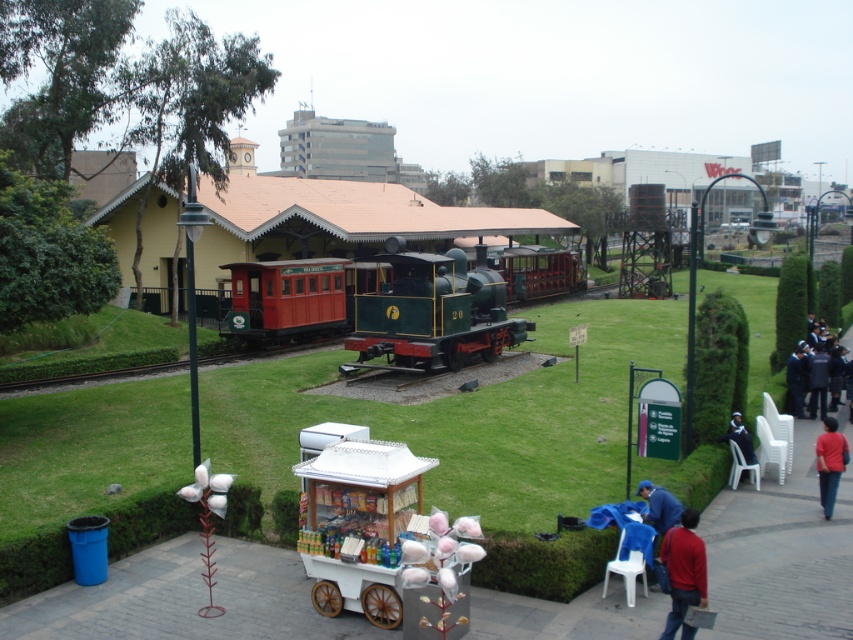
Question: Observing the image, what is the correct spatial positioning of dark blue uniform at right in reference to green metal train track at center?

Choices:
 (A) right
 (B) left

Answer: (A)

Question: Is green metal train track at center wider than black fabric jacket at lower right?

Choices:
 (A) no
 (B) yes

Answer: (B)

Question: Which of the following is the closest to the observer?

Choices:
 (A) red wooden train car at center
 (B) green polished wood train at center

Answer: (B)

Question: Which point appears closest to the camera in this image?

Choices:
 (A) (413, 541)
 (B) (669, 500)
 (C) (328, 332)

Answer: (A)

Question: Is metallic cart at center bigger than red matte jacket at lower right?

Choices:
 (A) yes
 (B) no

Answer: (A)

Question: Which is farther from the red cotton candy at lower right?

Choices:
 (A) red matte jacket at lower right
 (B) white wood cotton candy cart at center
 (C) green metal train track at center
 (D) black fabric jacket at lower right

Answer: (C)